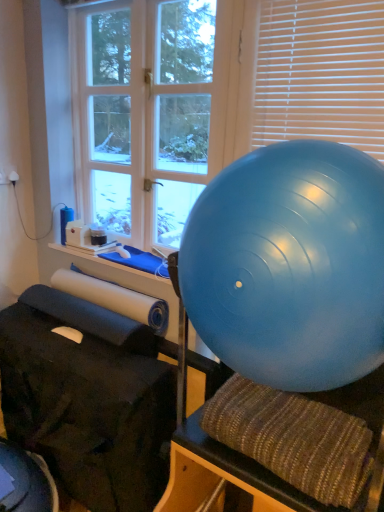
Question: Do you think white plastic blinds at upper right is within white wood window at upper left, or outside of it?

Choices:
 (A) inside
 (B) outside

Answer: (B)

Question: Considering the relative positions of white plastic blinds at upper right and white wood window at upper left in the image provided, is white plastic blinds at upper right to the left or to the right of white wood window at upper left?

Choices:
 (A) left
 (B) right

Answer: (B)

Question: Which of these objects is positioned farthest from the white plastic blinds at upper right?

Choices:
 (A) textured brown bean bag chair at center
 (B) blue rubber ball at right
 (C) white wood window at upper left

Answer: (A)

Question: Which is nearer to the white wood window at upper left?

Choices:
 (A) textured brown bean bag chair at center
 (B) white plastic blinds at upper right
 (C) blue rubber ball at right

Answer: (B)